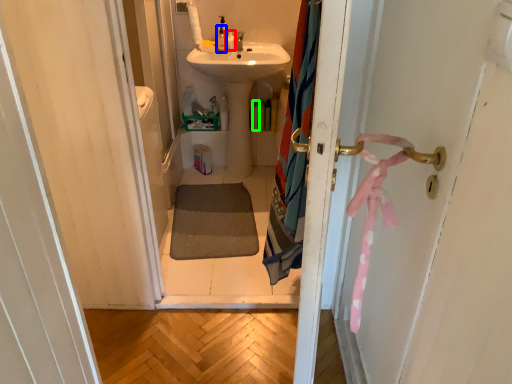
Question: Considering the real-world distances, which object is farthest from toiletry (highlighted by a red box)? toiletry (highlighted by a blue box) or toiletry (highlighted by a green box)?

Choices:
 (A) toiletry
 (B) toiletry

Answer: (B)